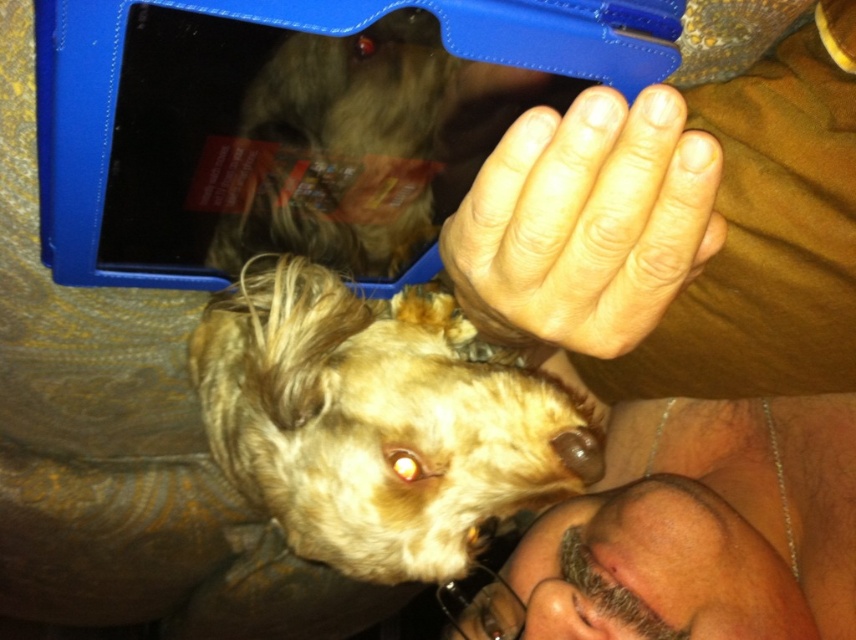
Between fuzzy brown dog at upper center and brown matte nose at center, which one has more height?

With more height is fuzzy brown dog at upper center.

Describe the element at coordinates (337, 148) in the screenshot. I see `fuzzy brown dog at upper center` at that location.

Where is `fuzzy brown dog at upper center`? This screenshot has height=640, width=856. fuzzy brown dog at upper center is located at coordinates click(337, 148).

Is point (245, 376) behind point (586, 589)?

No, it is not.

Does point (280, 528) lie in front of point (578, 620)?

No, it is not.

Describe the element at coordinates (377, 422) in the screenshot. The height and width of the screenshot is (640, 856). I see `fuzzy golden dog at center` at that location.

Locate an element on the screen. fuzzy golden dog at center is located at coordinates (377, 422).

Is fuzzy golden dog at center above fuzzy brown dog at upper center?

No, fuzzy golden dog at center is not above fuzzy brown dog at upper center.

Consider the image. Who is lower down, fuzzy golden dog at center or fuzzy brown dog at upper center?

Positioned lower is fuzzy golden dog at center.

Which is in front, point (373, 442) or point (256, 154)?

Point (256, 154) is more forward.

The width and height of the screenshot is (856, 640). Find the location of `fuzzy golden dog at center`. fuzzy golden dog at center is located at coordinates (377, 422).